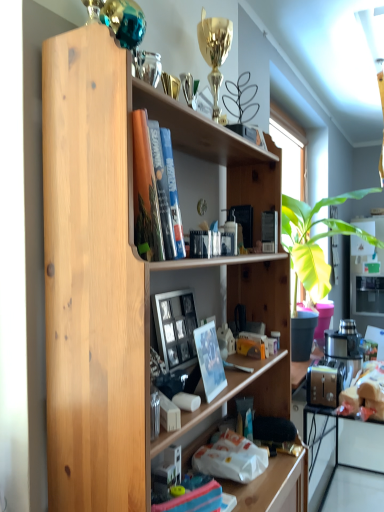
Question: Should I look upward or downward to see matte white photo frame at center?

Choices:
 (A) up
 (B) down

Answer: (B)

Question: From a real-world perspective, is wooden picture frame at center under white glossy computer at lower right?

Choices:
 (A) no
 (B) yes

Answer: (A)

Question: Is wooden picture frame at center bigger than white glossy computer at lower right?

Choices:
 (A) no
 (B) yes

Answer: (A)

Question: Can you confirm if wooden picture frame at center is positioned to the right of white glossy computer at lower right?

Choices:
 (A) no
 (B) yes

Answer: (A)

Question: From the image's perspective, is wooden picture frame at center above white glossy computer at lower right?

Choices:
 (A) yes
 (B) no

Answer: (A)

Question: Could you tell me if wooden picture frame at center is turned towards white glossy computer at lower right?

Choices:
 (A) no
 (B) yes

Answer: (A)

Question: Is wooden picture frame at center located outside white glossy computer at lower right?

Choices:
 (A) yes
 (B) no

Answer: (A)

Question: Considering the relative sizes of matte white photo frame at center and white glossy computer at lower right in the image provided, is matte white photo frame at center bigger than white glossy computer at lower right?

Choices:
 (A) no
 (B) yes

Answer: (A)

Question: Would you say matte white photo frame at center contains white glossy computer at lower right?

Choices:
 (A) no
 (B) yes

Answer: (A)

Question: Is matte white photo frame at center to the left of white glossy computer at lower right from the viewer's perspective?

Choices:
 (A) no
 (B) yes

Answer: (B)

Question: From the image's perspective, is matte white photo frame at center located beneath white glossy computer at lower right?

Choices:
 (A) yes
 (B) no

Answer: (B)

Question: Is matte white photo frame at center aimed at white glossy computer at lower right?

Choices:
 (A) no
 (B) yes

Answer: (A)

Question: Does matte white photo frame at center come behind white glossy computer at lower right?

Choices:
 (A) no
 (B) yes

Answer: (A)

Question: Can you confirm if matte white photo frame at center is smaller than natural wood bookshelf at center?

Choices:
 (A) yes
 (B) no

Answer: (A)